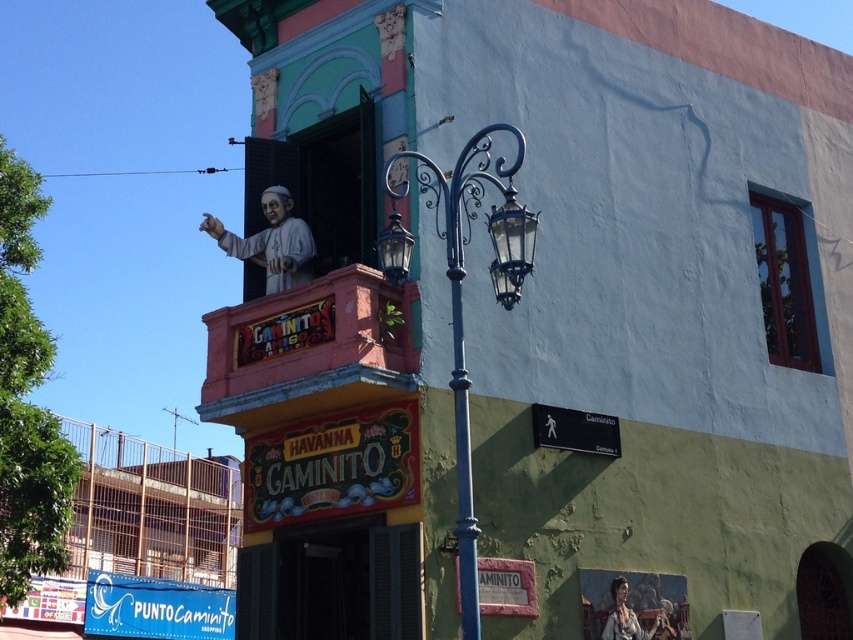
You are a painter standing at the base of the building and want to paint both the matte white statue at upper center and the matte brown fabric at lower right. Given that your ladder can reach up to 10 meters, can you safely reach both objects without moving the ladder?

The matte white statue at upper center and matte brown fabric at lower right are 11.18 meters apart from each other. Since the ladder can only reach up to 10 meters, you cannot safely reach both objects without moving the ladder because the distance between them exceeds the ladder capacity.

You are standing in front of the building and want to take a photo of both the polished metal streetlamp at center and the wooden frame window at upper right. Which object will appear larger in your photo?

The polished metal streetlamp at center will appear larger in the photo because it is closer to the viewer than the wooden frame window at upper right.

You are an architect analyzing the building facade. You notice the matte white statue at upper center and the matte brown fabric at lower right. Which object is positioned closer to the front of the building facade?

The matte white statue at upper center is positioned closer to the front of the building facade than the matte brown fabric at lower right, as the matte brown fabric at lower right is behind it.